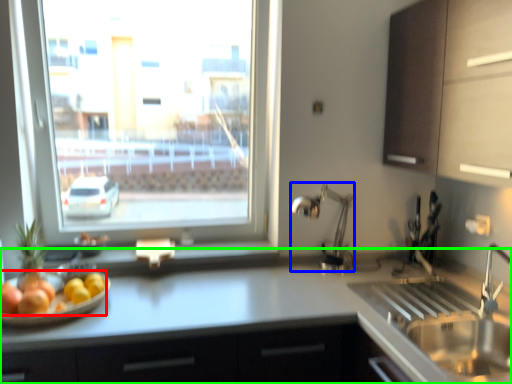
Question: Which object is positioned farthest from fruit (highlighted by a red box)? Select from faucet (highlighted by a blue box) and countertop (highlighted by a green box).

Choices:
 (A) faucet
 (B) countertop

Answer: (A)